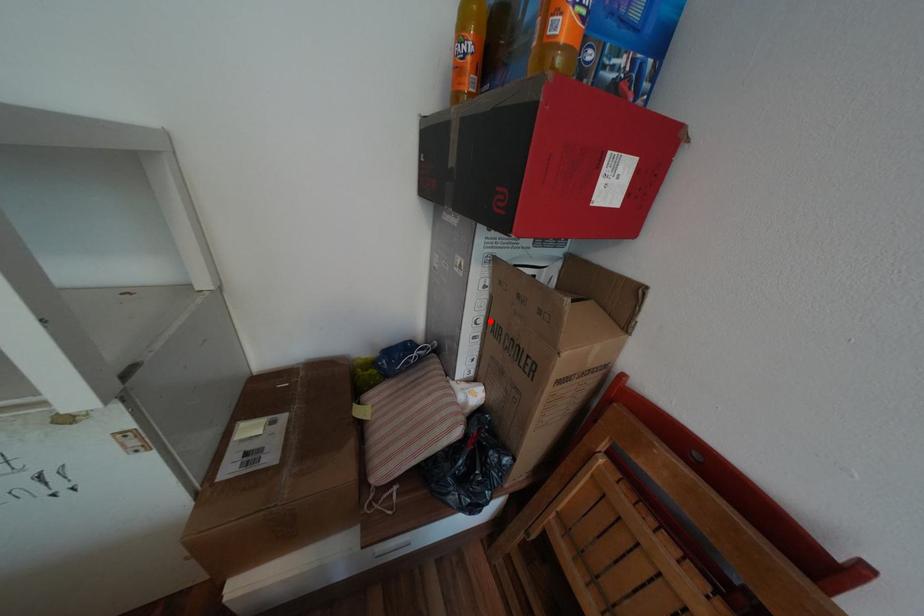
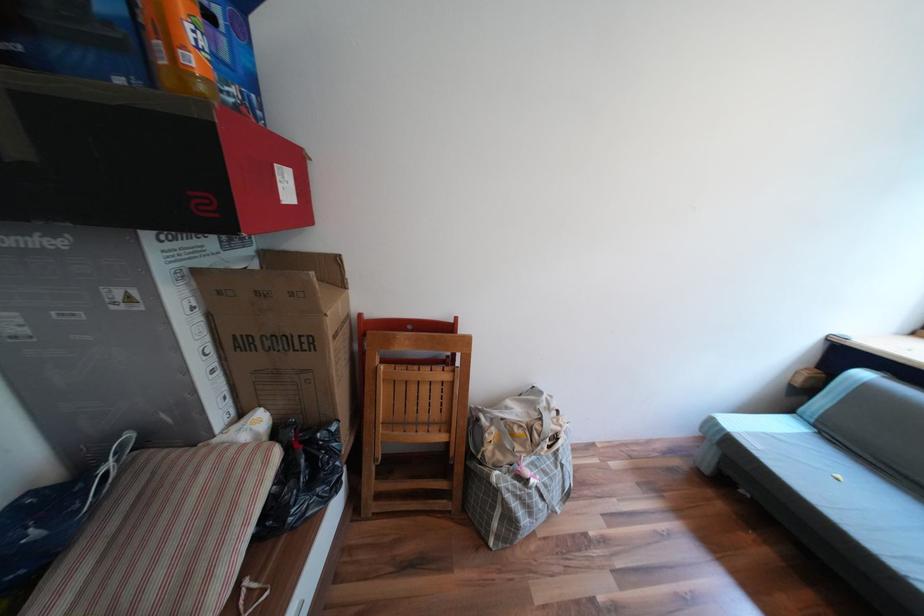
In the second image, find the point that corresponds to the highlighted location in the first image.

(219, 349)